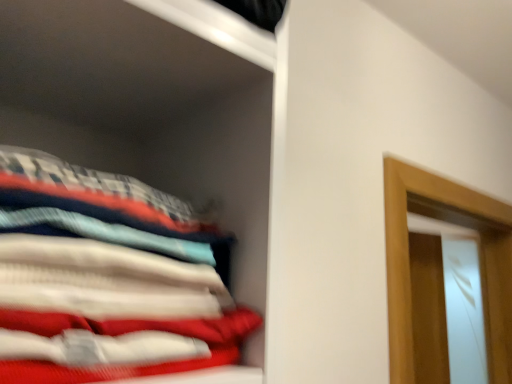
This screenshot has height=384, width=512. What do you see at coordinates (106, 278) in the screenshot? I see `soft cotton clothes at left` at bounding box center [106, 278].

At what (x,y) coordinates should I click in order to perform the action: click on soft cotton clothes at left. Please return your answer as a coordinate pair (x, y). Image resolution: width=512 pixels, height=384 pixels. Looking at the image, I should click on (106, 278).

The width and height of the screenshot is (512, 384). Find the location of `soft cotton clothes at left`. soft cotton clothes at left is located at coordinates point(106,278).